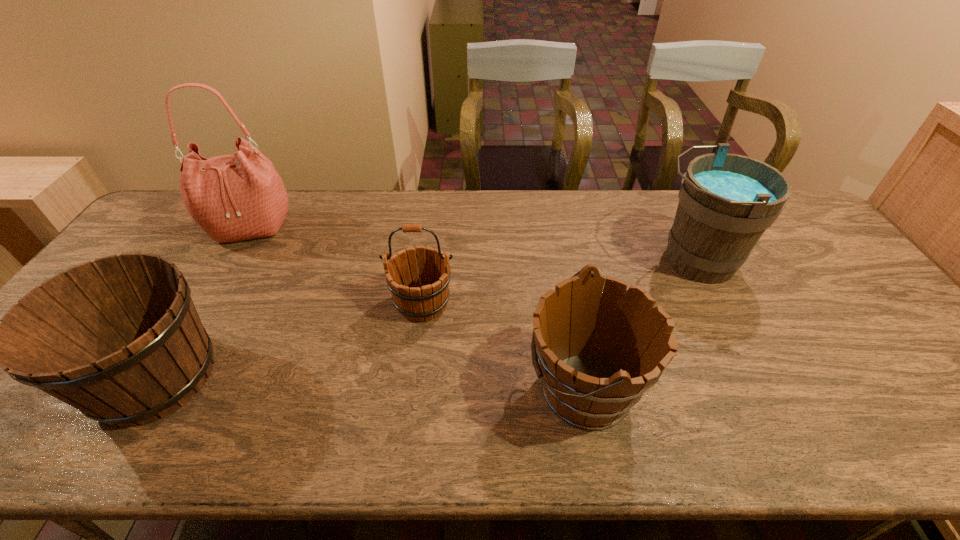
This screenshot has height=540, width=960. Identify the location of the tallest object. (237, 197).

Find the location of a particular element. This screenshot has width=960, height=540. the rightmost object is located at coordinates (726, 201).

Where is `the third wine bucket from right to left`? This screenshot has width=960, height=540. the third wine bucket from right to left is located at coordinates (415, 298).

This screenshot has width=960, height=540. In order to click on the second object from right to left in this screenshot , I will do `click(596, 362)`.

Find the location of a particular element. The width and height of the screenshot is (960, 540). the leftmost wine bucket is located at coordinates (119, 338).

Where is `free space located 0.260m on the front of the tallest object`? free space located 0.260m on the front of the tallest object is located at coordinates (199, 315).

The width and height of the screenshot is (960, 540). I want to click on vacant space located 0.250m with a handle on the side of the rightmost wine bucket, so click(x=563, y=260).

In order to click on free space located with a handle on the side of the rightmost wine bucket in this screenshot , I will do `click(580, 260)`.

You are a GUI agent. You are given a task and a screenshot of the screen. Output one action in this format:
    pyautogui.click(x=<x>, y=<y>)
    Task: Click on the vacant area situated 0.050m with a handle on the side of the rightmost wine bucket
    
    Given the screenshot: What is the action you would take?
    pyautogui.click(x=630, y=260)

The width and height of the screenshot is (960, 540). What are the coordinates of `free space located 0.300m on the front of the third object from right to left` in the screenshot? It's located at (405, 438).